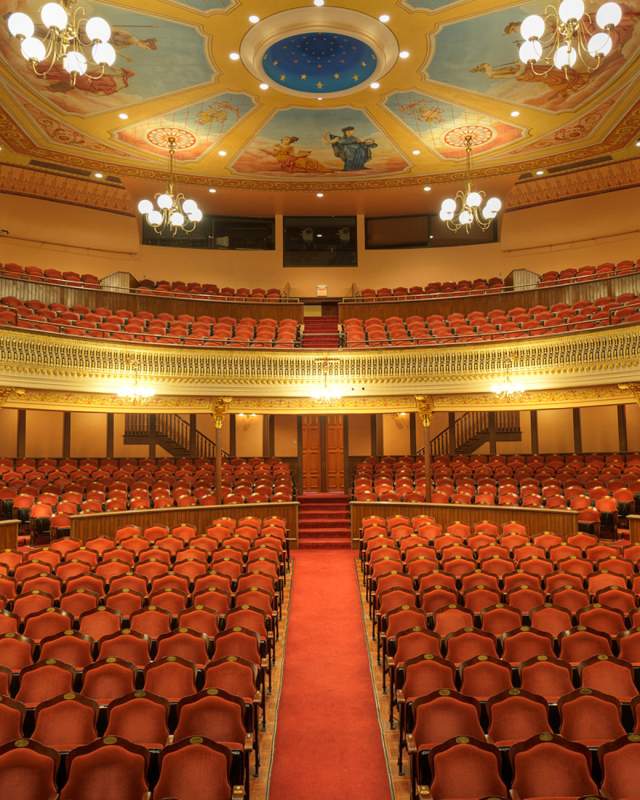
At what (x,y) coordinates should I click in order to perform the action: click on lights. Please return your answer as a coordinate pair (x, y). This screenshot has height=800, width=640. Looking at the image, I should click on (169, 206), (82, 58), (557, 50), (472, 214).